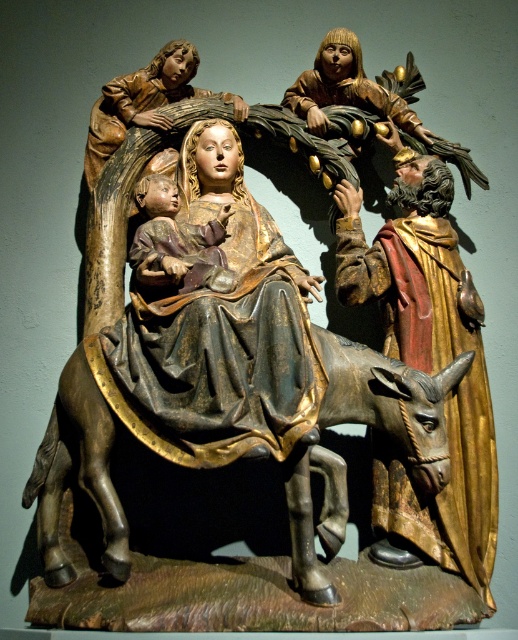
Who is more forward, (x=152, y=65) or (x=161, y=260)?

Positioned in front is point (x=161, y=260).

Between wooden child at upper center and matte gold baby at center, which one is positioned higher?

Positioned higher is wooden child at upper center.

The height and width of the screenshot is (640, 518). I want to click on wooden child at upper center, so click(145, 102).

Is matte gold baby at center wider than wooden figure at upper center?

No.

Who is positioned more to the right, matte gold baby at center or wooden figure at upper center?

wooden figure at upper center

Is point (161, 248) positioned after point (343, 77)?

No, it is in front of (343, 77).

The image size is (518, 640). I want to click on matte gold baby at center, so click(x=179, y=240).

In the scene shown: Can you confirm if bronze/golden donkey at center is taller than wooden figure at upper center?

Indeed, bronze/golden donkey at center has a greater height compared to wooden figure at upper center.

Identify the location of bronze/golden donkey at center. (372, 426).

Who is more distant from viewer, (299, 528) or (380, 99)?

Positioned behind is point (380, 99).

Where is `bronze/golden donkey at center`? The image size is (518, 640). bronze/golden donkey at center is located at coordinates (372, 426).